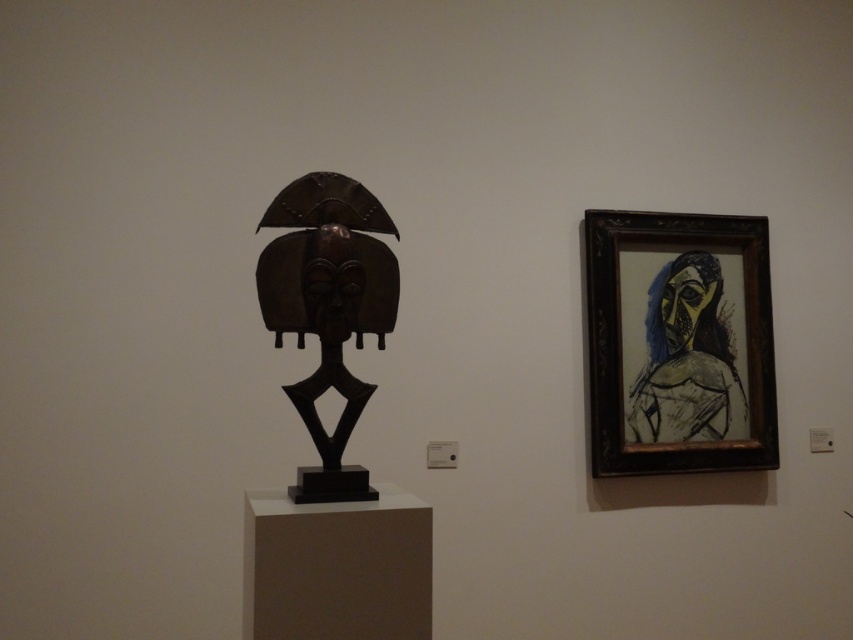
Consider the image. Is shiny brown wood mask at left smaller than yellowish sketch at right?

Indeed, shiny brown wood mask at left has a smaller size compared to yellowish sketch at right.

Can you confirm if shiny brown wood mask at left is wider than yellowish sketch at right?

No, shiny brown wood mask at left is not wider than yellowish sketch at right.

Describe the element at coordinates (328, 308) in the screenshot. I see `shiny brown wood mask at left` at that location.

The width and height of the screenshot is (853, 640). What are the coordinates of `shiny brown wood mask at left` in the screenshot? It's located at (328, 308).

How far apart are wooden framed portrait at right and yellowish sketch at right?

wooden framed portrait at right and yellowish sketch at right are 1.55 inches apart from each other.

Between wooden framed portrait at right and yellowish sketch at right, which one is positioned higher?

Positioned higher is wooden framed portrait at right.

Is point (724, 321) positioned in front of point (724, 358)?

No.

Find the location of a particular element. Image resolution: width=853 pixels, height=640 pixels. wooden framed portrait at right is located at coordinates (682, 346).

Describe the element at coordinates (682, 346) in the screenshot. Image resolution: width=853 pixels, height=640 pixels. I see `wooden framed portrait at right` at that location.

Measure the distance from wooden framed portrait at right to shiny brown wood mask at left.

wooden framed portrait at right and shiny brown wood mask at left are 4.55 feet apart from each other.

Identify the location of wooden framed portrait at right. (682, 346).